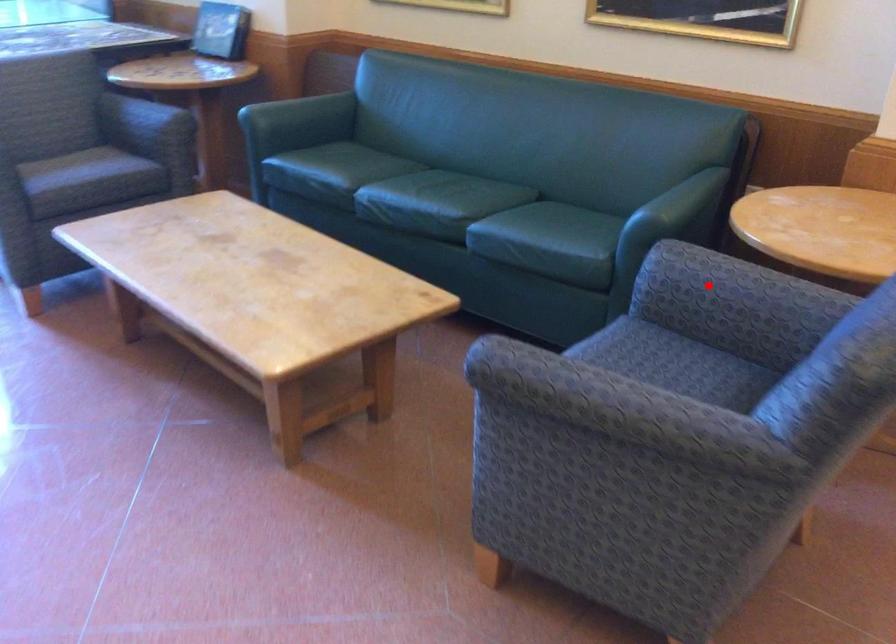
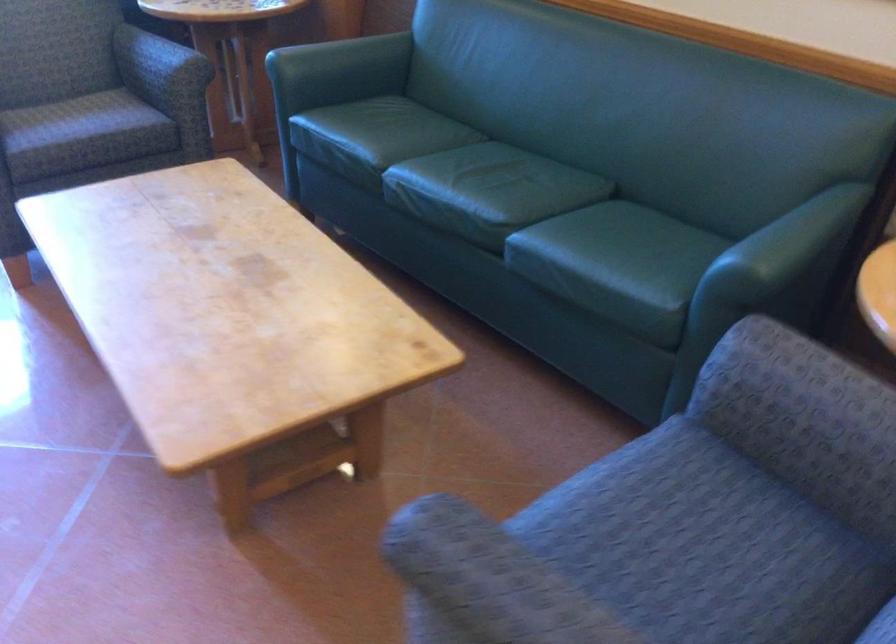
Question: A red point is marked in image1. In image2, is the corresponding 3D point closer to the camera or farther? Reply with the corresponding letter.

Choices:
 (A) The corresponding 3D point is closer.
 (B) The corresponding 3D point is farther.

Answer: (A)